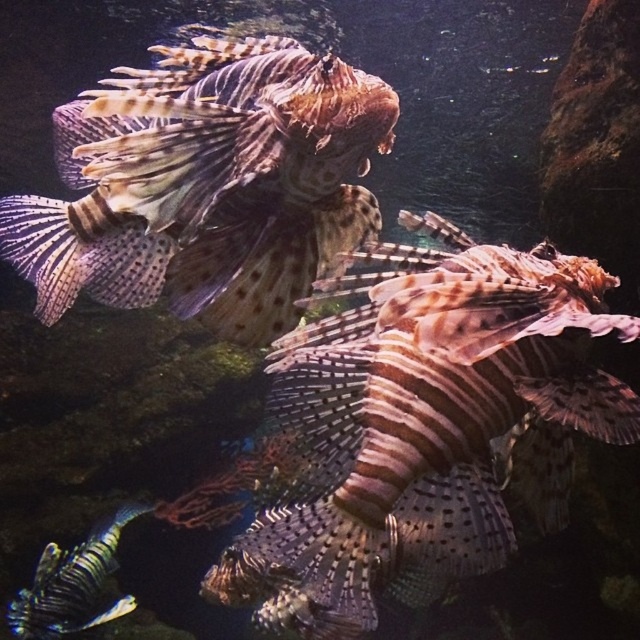
You are an underwater photographer aiming to capture a closeup of the lionfish in the scene. You have two points marked in the image for reference. Which point, point (444, 547) or point (109, 515), is better for positioning your camera to get a closer shot?

Point (444, 547) is closer to the viewer than point (109, 515), so positioning your camera at point (444, 547) will allow for a closer shot of the lionfish.

You are an underwater photographer aiming to capture a closeup shot of the brown textured lionfish at center and the shiny blue fish at bottom left. Given their sizes, which one would require you to get closer to fill the frame?

The shiny blue fish at bottom left requires you to get closer because it is smaller in size compared to the brown textured lionfish at center.